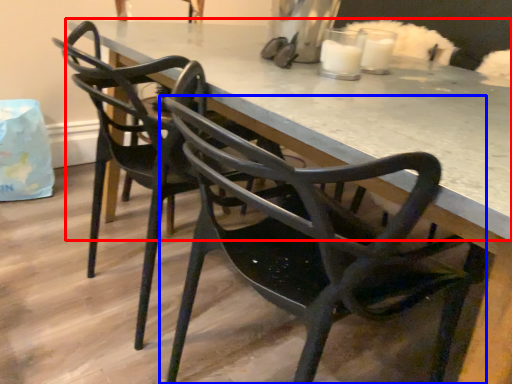
Question: Which object appears closest to the camera in this image, table (highlighted by a red box) or chair (highlighted by a blue box)?

Choices:
 (A) table
 (B) chair

Answer: (B)